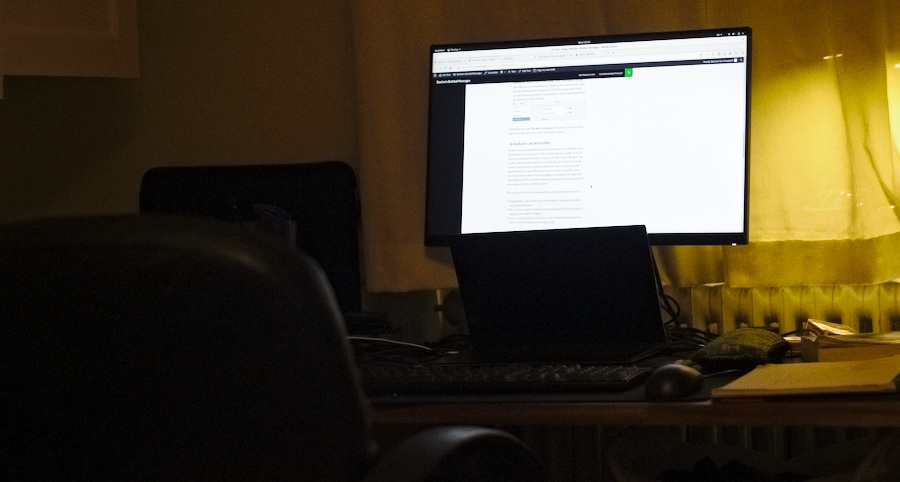
Find the location of a particular element. The height and width of the screenshot is (482, 900). chair arm is located at coordinates (435, 447).